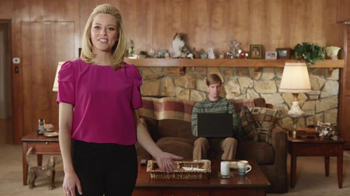
In order to click on coffee table in this screenshot , I will do `click(216, 181)`.